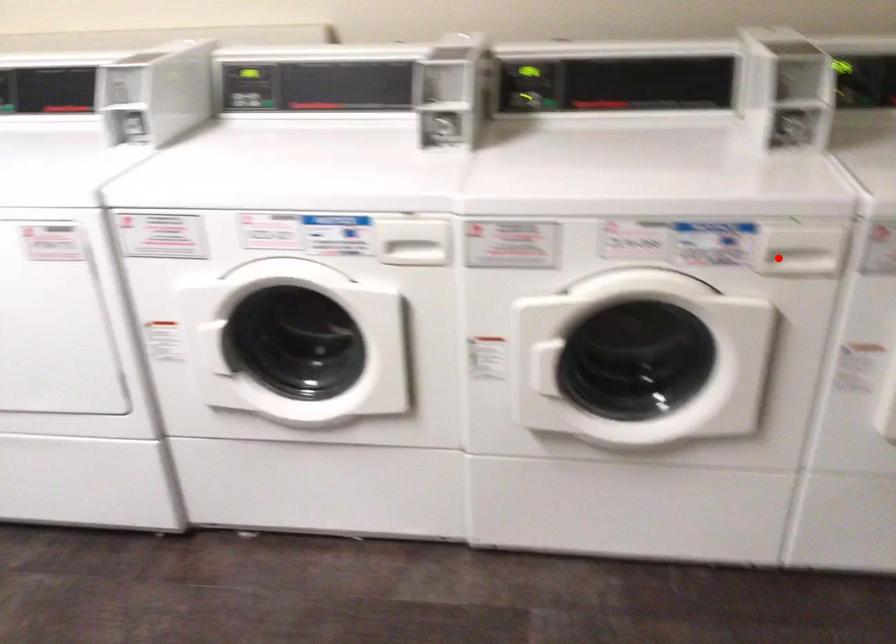
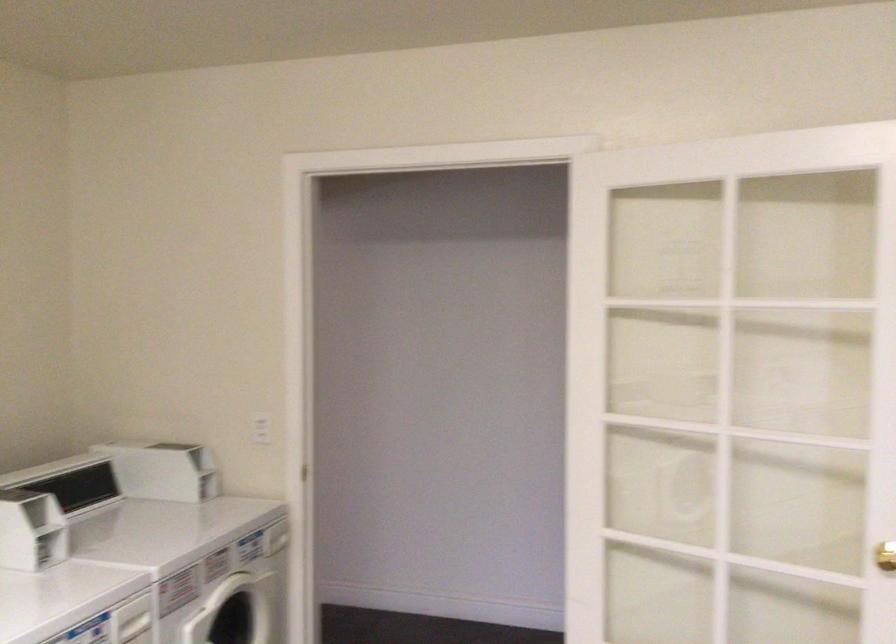
Question: A red point is marked in image1. In image2, is the corresponding 3D point closer to the camera or farther? Reply with the corresponding letter.

Choices:
 (A) The corresponding 3D point is closer.
 (B) The corresponding 3D point is farther.

Answer: (B)